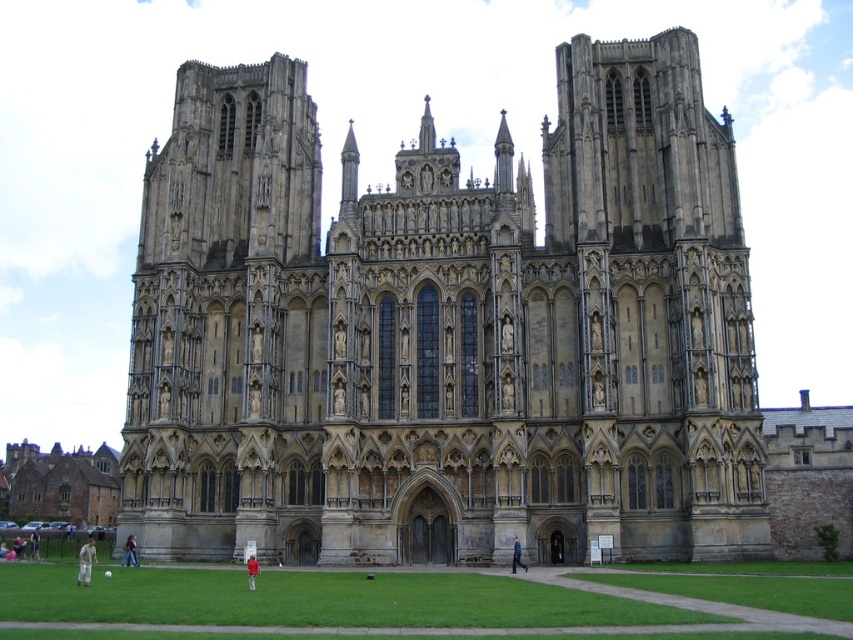
Can you confirm if stone church at center is thinner than brown stone church at lower left?

No.

Image resolution: width=853 pixels, height=640 pixels. I want to click on stone church at center, so click(x=445, y=332).

At what (x,y) coordinates should I click in order to perform the action: click on stone church at center. Please return your answer as a coordinate pair (x, y). Looking at the image, I should click on (445, 332).